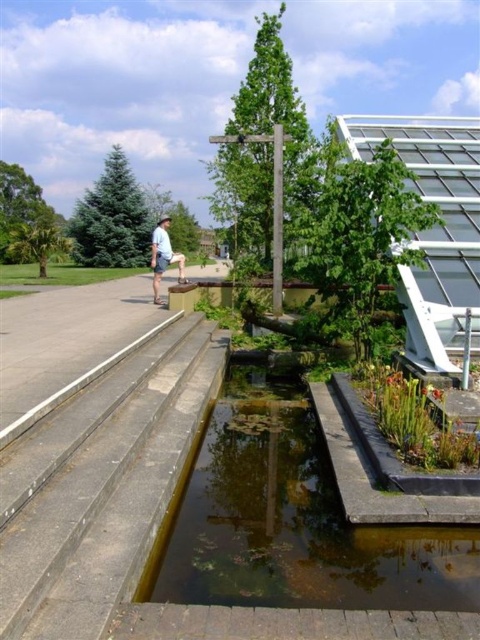
Question: Can you confirm if green mossy concrete water at center is smaller than light blue denim shorts at left?

Choices:
 (A) yes
 (B) no

Answer: (A)

Question: Which point is farther from the camera taking this photo?

Choices:
 (A) (212, 365)
 (B) (417, 468)
 (C) (169, 260)
 (D) (252, 557)

Answer: (C)

Question: Is green mossy concrete water at center closer to camera compared to gray concrete steps at lower left?

Choices:
 (A) yes
 (B) no

Answer: (B)

Question: Which object is closer to the camera taking this photo?

Choices:
 (A) green mossy concrete water at center
 (B) light blue denim shorts at left
 (C) green leafy plants at center

Answer: (A)

Question: Which point appears closest to the camera in this image?

Choices:
 (A) (442, 417)
 (B) (156, 289)
 (C) (195, 417)
 (D) (389, 577)

Answer: (D)

Question: Does green mossy concrete water at center have a lesser width compared to gray concrete steps at lower left?

Choices:
 (A) yes
 (B) no

Answer: (B)